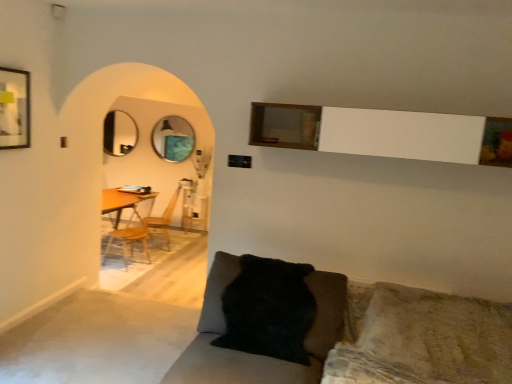
Question: Is metallic circular mirror at center, the first mirror from the right, placed right next to wooden armchair at center?

Choices:
 (A) yes
 (B) no

Answer: (B)

Question: Is metallic circular mirror at center, arranged as the second mirror when viewed from the left, positioned beyond the bounds of wooden armchair at center?

Choices:
 (A) yes
 (B) no

Answer: (A)

Question: Considering the relative sizes of metallic circular mirror at center, the first mirror from the right, and wooden armchair at center in the image provided, is metallic circular mirror at center, the first mirror from the right, bigger than wooden armchair at center?

Choices:
 (A) no
 (B) yes

Answer: (A)

Question: From a real-world perspective, is metallic circular mirror at center, arranged as the second mirror when viewed from the left, under wooden armchair at center?

Choices:
 (A) no
 (B) yes

Answer: (A)

Question: Is metallic circular mirror at center, arranged as the second mirror when viewed from the left, thinner than wooden armchair at center?

Choices:
 (A) yes
 (B) no

Answer: (A)

Question: From the image's perspective, is metallic circular mirror at center, the first mirror from the right, on wooden armchair at center?

Choices:
 (A) yes
 (B) no

Answer: (A)

Question: Is wooden armchair at center located outside matte black picture frame at upper left?

Choices:
 (A) yes
 (B) no

Answer: (A)

Question: From the image's perspective, is wooden armchair at center on top of matte black picture frame at upper left?

Choices:
 (A) no
 (B) yes

Answer: (A)

Question: Is wooden armchair at center oriented away from matte black picture frame at upper left?

Choices:
 (A) no
 (B) yes

Answer: (A)

Question: Can you confirm if wooden armchair at center is thinner than matte black picture frame at upper left?

Choices:
 (A) no
 (B) yes

Answer: (A)

Question: Is wooden armchair at center oriented towards matte black picture frame at upper left?

Choices:
 (A) yes
 (B) no

Answer: (B)

Question: Considering the relative sizes of wooden armchair at center and matte black picture frame at upper left in the image provided, is wooden armchair at center taller than matte black picture frame at upper left?

Choices:
 (A) no
 (B) yes

Answer: (B)

Question: Can you confirm if wooden armchair at center is positioned to the left of black fuzzy pillow at lower center?

Choices:
 (A) no
 (B) yes

Answer: (B)